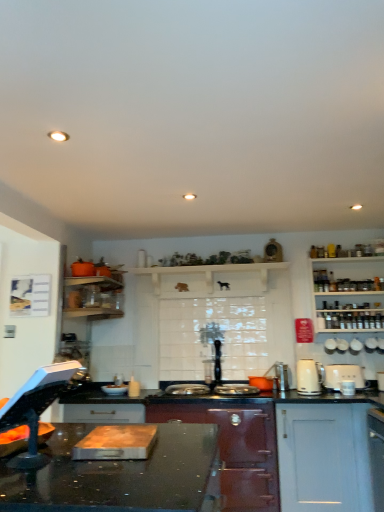
Question: Is matte dark red stove at center, the second cabinetry viewed from the right, touching black glossy countertop at center?

Choices:
 (A) no
 (B) yes

Answer: (A)

Question: Is matte dark red stove at center, the second cabinetry viewed from the right, shorter than black glossy countertop at center?

Choices:
 (A) no
 (B) yes

Answer: (A)

Question: Is matte dark red stove at center, the second cabinetry viewed from the right, in front of black glossy countertop at center?

Choices:
 (A) no
 (B) yes

Answer: (A)

Question: Is matte dark red stove at center, the first cabinetry in the left-to-right sequence, at the left side of black glossy countertop at center?

Choices:
 (A) no
 (B) yes

Answer: (A)

Question: Is matte dark red stove at center, the second cabinetry viewed from the right, positioned behind black glossy countertop at center?

Choices:
 (A) no
 (B) yes

Answer: (B)

Question: Is point (334, 379) positioned closer to the camera than point (352, 349)?

Choices:
 (A) farther
 (B) closer

Answer: (B)

Question: Is white plastic toaster at right, the first kitchen appliance viewed from the right, spatially inside white ceramic cups at upper right, the second appliance when ordered from right to left, or outside of it?

Choices:
 (A) outside
 (B) inside

Answer: (A)

Question: From their relative heights in the image, would you say white plastic toaster at right, the first kitchen appliance viewed from the right, is taller or shorter than white ceramic cups at upper right, which is the fourth appliance in left-to-right order?

Choices:
 (A) short
 (B) tall

Answer: (B)

Question: Considering the positions of white plastic toaster at right, the first kitchen appliance viewed from the right, and white ceramic cups at upper right, the second appliance when ordered from right to left, in the image, is white plastic toaster at right, the first kitchen appliance viewed from the right, bigger or smaller than white ceramic cups at upper right, the second appliance when ordered from right to left,?

Choices:
 (A) big
 (B) small

Answer: (A)

Question: From a real-world perspective, relative to white ceramic kettle at upper right, arranged as the 4th appliance when viewed from the right, is black glossy countertop at center vertically above or below?

Choices:
 (A) above
 (B) below

Answer: (B)

Question: In terms of size, does black glossy countertop at center appear bigger or smaller than white ceramic kettle at upper right, arranged as the 4th appliance when viewed from the right?

Choices:
 (A) small
 (B) big

Answer: (B)

Question: Considering the positions of black glossy countertop at center and white ceramic kettle at upper right, arranged as the 4th appliance when viewed from the right, in the image, is black glossy countertop at center wider or thinner than white ceramic kettle at upper right, arranged as the 4th appliance when viewed from the right,?

Choices:
 (A) wide
 (B) thin

Answer: (A)

Question: Is black glossy countertop at center taller or shorter than white ceramic kettle at upper right, which ranks as the second appliance in left-to-right order?

Choices:
 (A) tall
 (B) short

Answer: (A)

Question: Relative to white wooden shelves at right, is orange matte pot at center, positioned as the fifth appliance in right-to-left order, in front or behind?

Choices:
 (A) behind
 (B) front

Answer: (B)

Question: Looking at the image, does orange matte pot at center, placed as the 1th appliance when sorted from left to right, seem bigger or smaller compared to white wooden shelves at right?

Choices:
 (A) small
 (B) big

Answer: (A)